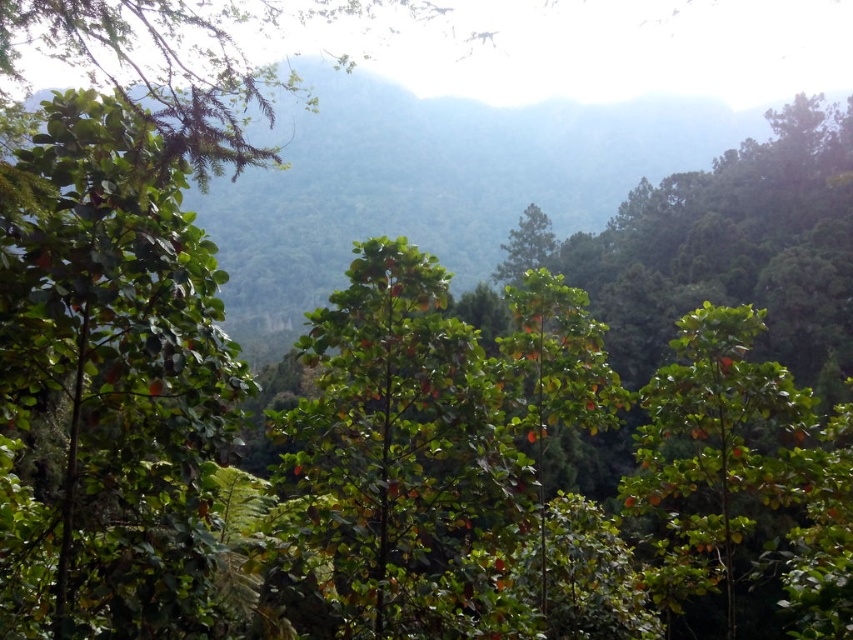
Question: Which of the following is the farthest from the observer?

Choices:
 (A) (703, 314)
 (B) (59, 518)

Answer: (A)

Question: Among these points, which one is farthest from the camera?

Choices:
 (A) (97, 440)
 (B) (772, 547)

Answer: (B)

Question: Does green matte tree at left appear under green matte tree at right?

Choices:
 (A) yes
 (B) no

Answer: (B)

Question: Is green matte tree at left thinner than green matte tree at right?

Choices:
 (A) no
 (B) yes

Answer: (B)

Question: Is green matte tree at left positioned in front of green matte tree at right?

Choices:
 (A) no
 (B) yes

Answer: (A)